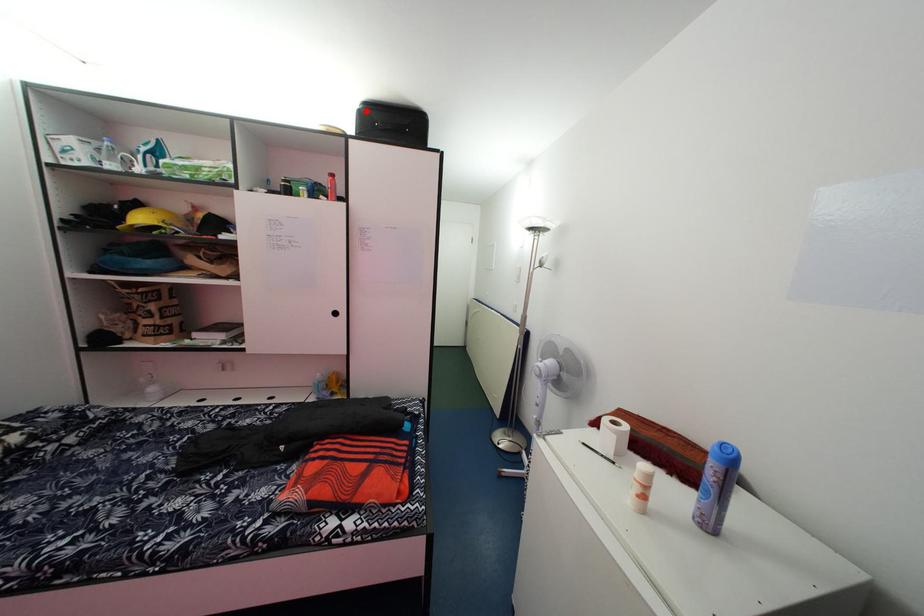
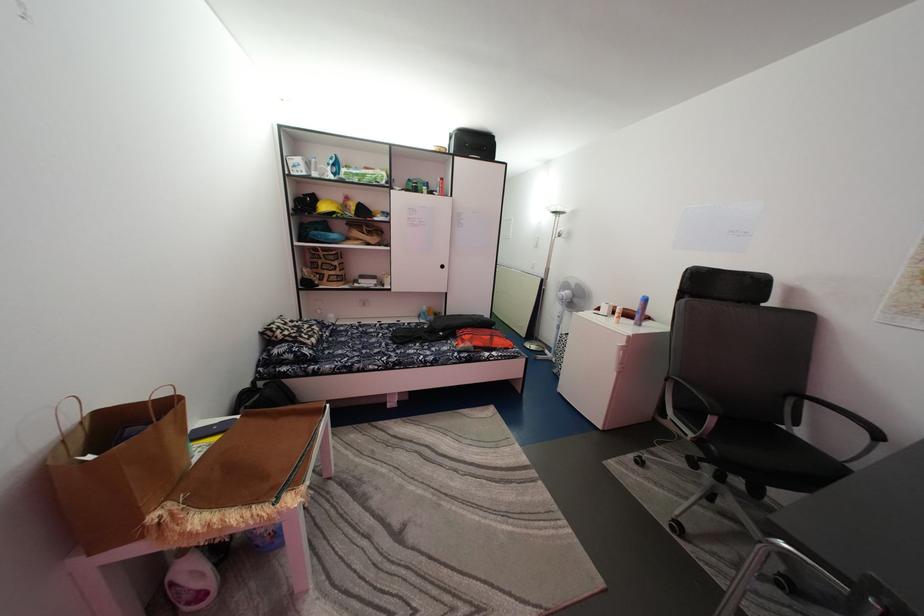
Where in the second image is the point corresponding to the highlighted location from the first image?

(462, 137)